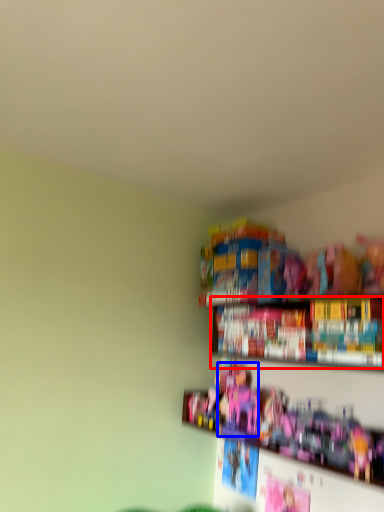
Question: Which object appears closest to the camera in this image, book (highlighted by a red box) or toy (highlighted by a blue box)?

Choices:
 (A) book
 (B) toy

Answer: (A)